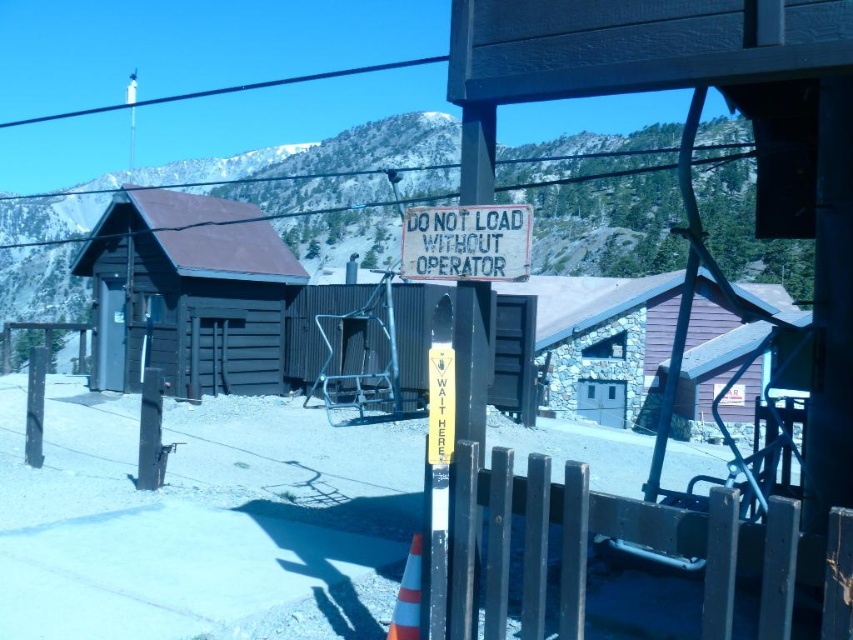
Question: Can you confirm if black wire at upper center is positioned above orange reflective cone at center?

Choices:
 (A) yes
 (B) no

Answer: (A)

Question: Is dark brown wooden hut at center to the left of orange reflective cone at center from the viewer's perspective?

Choices:
 (A) no
 (B) yes

Answer: (B)

Question: Which point is farther to the camera?

Choices:
 (A) black wire at upper center
 (B) dark brown wooden hut at center
 (C) orange reflective cone at center

Answer: (A)

Question: Is dark brown wooden hut at center wider than black wire at upper center?

Choices:
 (A) no
 (B) yes

Answer: (A)

Question: Among these points, which one is nearest to the camera?

Choices:
 (A) (279, 83)
 (B) (402, 632)

Answer: (B)

Question: Which point appears farthest from the camera in this image?

Choices:
 (A) (410, 596)
 (B) (589, 403)
 (C) (407, 60)

Answer: (C)